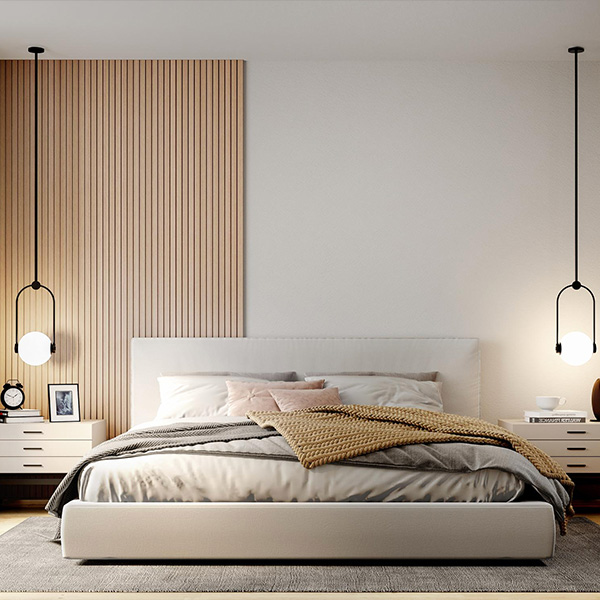
Image resolution: width=600 pixels, height=600 pixels. I want to click on handle, so click(578, 464), click(576, 449), click(578, 431), click(28, 430), click(31, 450), click(31, 465).